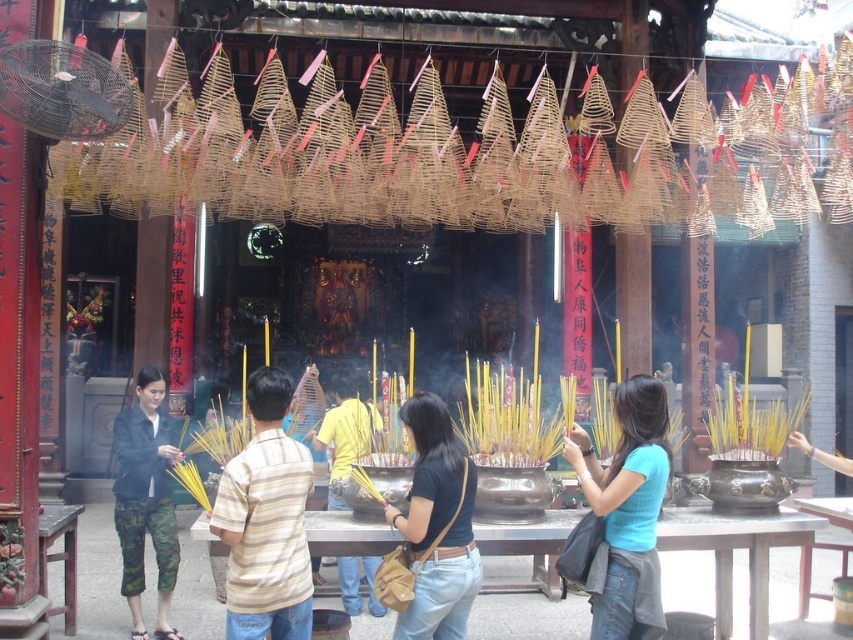
You are standing in the temple and notice two items at the center of the scene. The striped cotton shirt at center and the black leather bag at center. Which one has a greater height?

The striped cotton shirt at center is taller than the black leather bag at center.